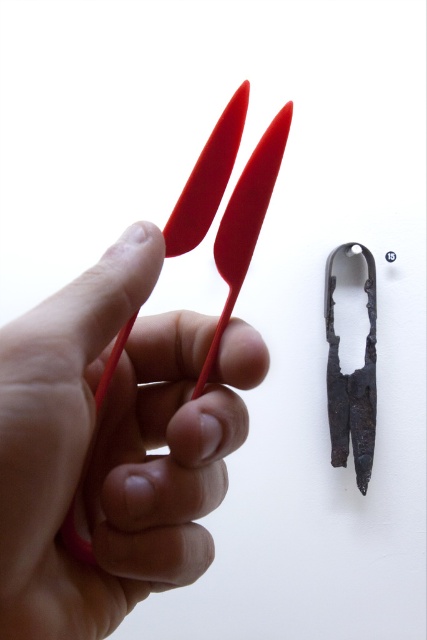
Is point (64, 580) positioned behind point (199, 173)?

That is False.

Find the location of `matte plastic scissors at center`. matte plastic scissors at center is located at coordinates (111, 445).

Where is `matte plastic scissors at center`? Image resolution: width=427 pixels, height=640 pixels. matte plastic scissors at center is located at coordinates (111, 445).

At what (x,y) coordinates should I click in order to perform the action: click on matte plastic scissors at center. Please return your answer as a coordinate pair (x, y). Looking at the image, I should click on (111, 445).